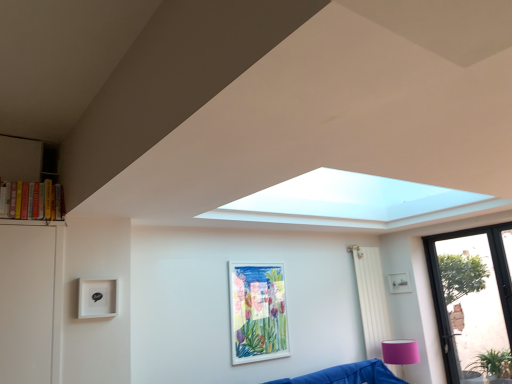
Question: Would you say white fabric curtain at right is outside white matte picture frame at center, marked as the first picture frame in a front-to-back arrangement?

Choices:
 (A) yes
 (B) no

Answer: (A)

Question: Does white fabric curtain at right appear on the left side of white matte picture frame at center, which is counted as the 1th picture frame, starting from the left?

Choices:
 (A) no
 (B) yes

Answer: (A)

Question: Considering the relative sizes of white fabric curtain at right and white matte picture frame at center, which is counted as the 1th picture frame, starting from the left, in the image provided, is white fabric curtain at right bigger than white matte picture frame at center, which is counted as the 1th picture frame, starting from the left,?

Choices:
 (A) yes
 (B) no

Answer: (A)

Question: Is white matte picture frame at center, which is counted as the 1th picture frame, starting from the left, inside white fabric curtain at right?

Choices:
 (A) no
 (B) yes

Answer: (A)

Question: Is white fabric curtain at right further to the viewer compared to white matte picture frame at center, which appears as the 2th picture frame when viewed from the back?

Choices:
 (A) no
 (B) yes

Answer: (B)

Question: From a real-world perspective, is white fabric curtain at right beneath white matte picture frame at center, marked as the first picture frame in a front-to-back arrangement?

Choices:
 (A) no
 (B) yes

Answer: (B)

Question: Does white fabric curtain at right have a smaller size compared to hardcover books at left?

Choices:
 (A) yes
 (B) no

Answer: (B)

Question: Is the position of white fabric curtain at right more distant than that of hardcover books at left?

Choices:
 (A) yes
 (B) no

Answer: (A)

Question: Could you tell me if white fabric curtain at right is turned towards hardcover books at left?

Choices:
 (A) yes
 (B) no

Answer: (B)

Question: Is white fabric curtain at right wider than hardcover books at left?

Choices:
 (A) no
 (B) yes

Answer: (B)

Question: Is white fabric curtain at right to the left of hardcover books at left from the viewer's perspective?

Choices:
 (A) yes
 (B) no

Answer: (B)

Question: Considering the relative sizes of white fabric curtain at right and hardcover books at left in the image provided, is white fabric curtain at right bigger than hardcover books at left?

Choices:
 (A) yes
 (B) no

Answer: (A)

Question: Is the depth of pink fabric lampshade at lower right greater than that of transparent glass door at lower right?

Choices:
 (A) yes
 (B) no

Answer: (A)